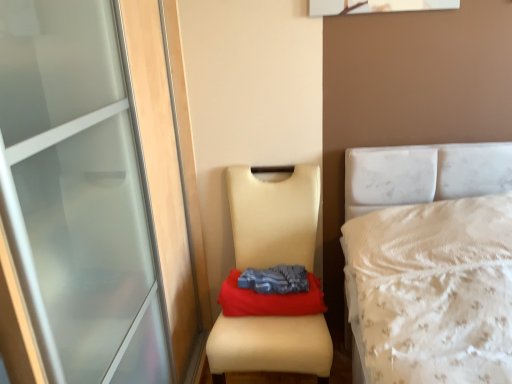
Question: Considering the relative positions of beige leather chair at center and blue fabric at center in the image provided, is beige leather chair at center to the left or to the right of blue fabric at center?

Choices:
 (A) right
 (B) left

Answer: (B)

Question: In terms of width, does beige leather chair at center look wider or thinner when compared to blue fabric at center?

Choices:
 (A) thin
 (B) wide

Answer: (B)

Question: Which is farther from the blue fabric at center?

Choices:
 (A) blue fabric at center
 (B) beige leather chair at center

Answer: (B)

Question: Based on their relative distances, which object is farther from the beige leather chair at center?

Choices:
 (A) blue fabric at center
 (B) blue fabric at center

Answer: (A)